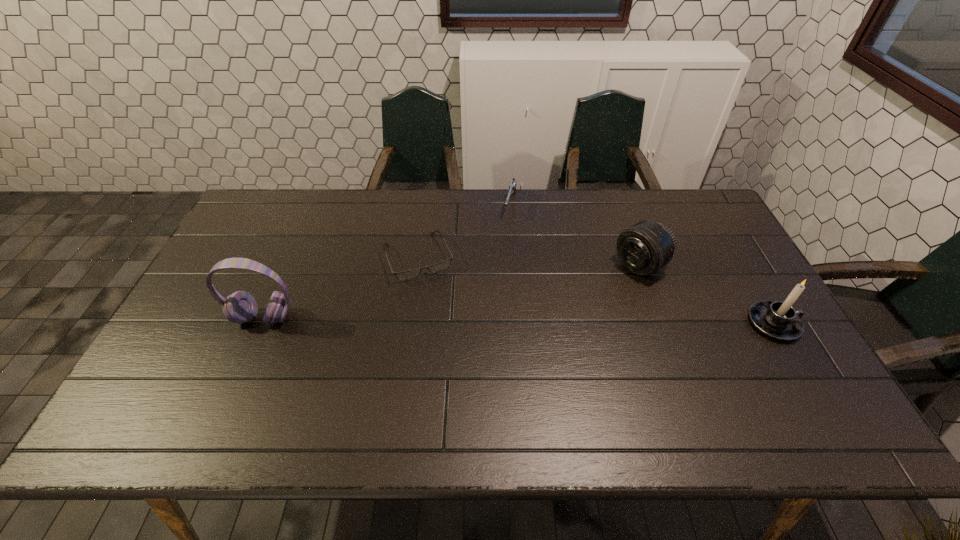
Where is `vacant space on the desktop that is between the tallest object and the candle holder and is positioned on the front-facing side of the shortest object`? This screenshot has height=540, width=960. vacant space on the desktop that is between the tallest object and the candle holder and is positioned on the front-facing side of the shortest object is located at coordinates (445, 320).

I want to click on vacant space on the desktop that is between the headset and the candle holder and is positioned on the front-facing side of the third shortest object, so click(x=552, y=321).

Where is `vacant spot on the desktop that is between the headset and the candle holder and is positioned on the front-facing side of the second shortest object`? vacant spot on the desktop that is between the headset and the candle holder and is positioned on the front-facing side of the second shortest object is located at coordinates (474, 320).